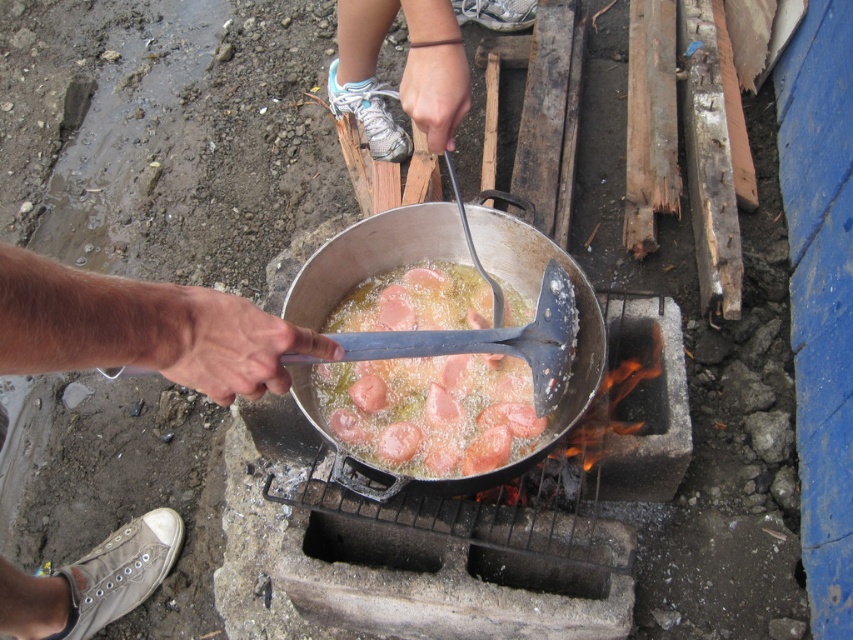
Question: Among these objects, which one is farthest from the camera?

Choices:
 (A) smooth skin hand at lower left
 (B) pink glossy sausages at center
 (C) white fabric hand at upper center

Answer: (C)

Question: Which of the following is the closest to the observer?

Choices:
 (A) (456, 305)
 (B) (56, 573)

Answer: (A)

Question: Is pink glossy sausages at center to the right of white fabric hand at upper center from the viewer's perspective?

Choices:
 (A) no
 (B) yes

Answer: (B)

Question: Based on their relative distances, which object is farther from the pink glossy sausages at center?

Choices:
 (A) white fabric hand at upper center
 (B) smooth skin hand at lower left

Answer: (A)

Question: Can you confirm if pink glossy sausages at center is positioned above white fabric hand at upper center?

Choices:
 (A) yes
 (B) no

Answer: (B)

Question: From the image, what is the correct spatial relationship of pink glossy sausages at center in relation to white fabric hand at upper center?

Choices:
 (A) below
 (B) above

Answer: (A)